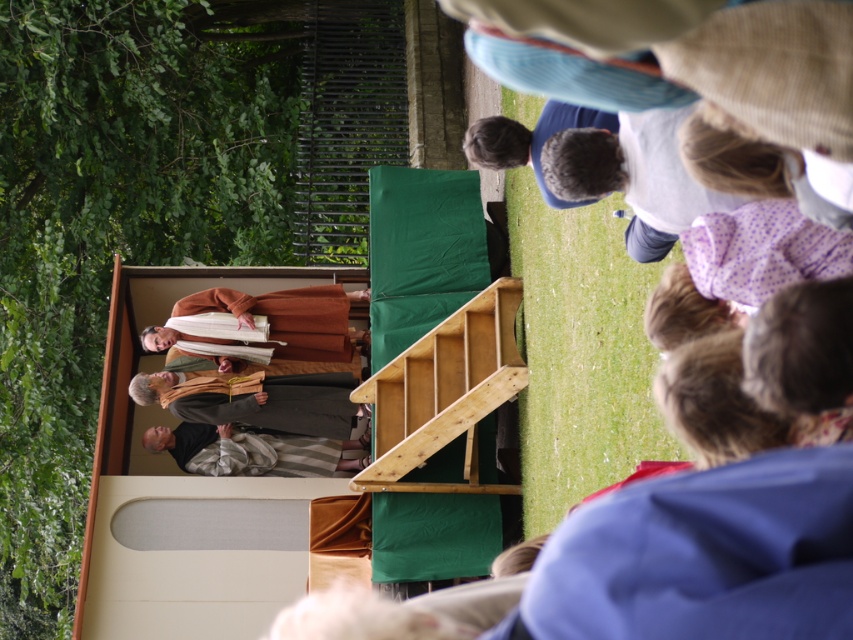
Is light brown wooden stairs at center taller than smooth gray robe at center?

Yes, light brown wooden stairs at center is taller than smooth gray robe at center.

Can you confirm if light brown wooden stairs at center is bigger than smooth gray robe at center?

Correct, light brown wooden stairs at center is larger in size than smooth gray robe at center.

Which is behind, point (503, 336) or point (144, 396)?

Point (144, 396)

I want to click on light brown wooden stairs at center, so click(x=444, y=394).

Does light brown wooden stairs at center have a greater height compared to striped fabric at center?

Indeed, light brown wooden stairs at center has a greater height compared to striped fabric at center.

Identify the location of light brown wooden stairs at center. The width and height of the screenshot is (853, 640). (444, 394).

Is point (434, 342) behind point (192, 436)?

No, it is in front of (192, 436).

Where is `light brown wooden stairs at center`? The image size is (853, 640). light brown wooden stairs at center is located at coordinates (444, 394).

Does smooth gray robe at center appear on the left side of striped fabric at center?

Yes, smooth gray robe at center is to the left of striped fabric at center.

Which is more to the left, smooth gray robe at center or striped fabric at center?

smooth gray robe at center

Is point (305, 401) positioned after point (231, 433)?

No.

The width and height of the screenshot is (853, 640). Identify the location of smooth gray robe at center. (274, 403).